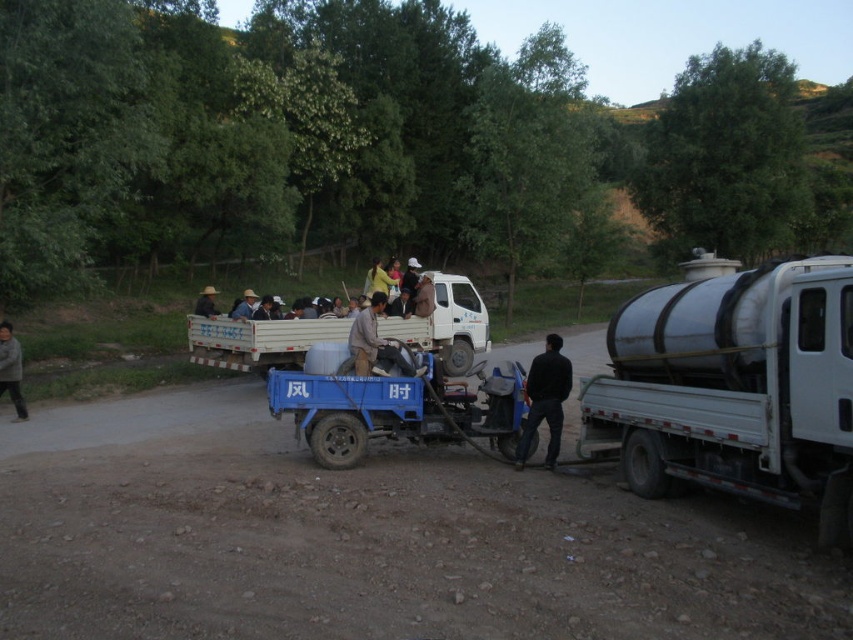
Question: Which point is farther to the camera?

Choices:
 (A) light brown leather jacket at center
 (B) white matte truck at center

Answer: (B)

Question: From the image, what is the correct spatial relationship of white matte truck at center in relation to light brown fabric hat at center?

Choices:
 (A) right
 (B) left

Answer: (A)

Question: Can you confirm if light brown leather jacket at center is thinner than brown fabric hat at upper center?

Choices:
 (A) no
 (B) yes

Answer: (B)

Question: Based on their relative distances, which object is nearer to the blue plastic wagon at center?

Choices:
 (A) brown textured jacket at lower left
 (B) black matte person at center
 (C) light brown fabric hat at center

Answer: (B)

Question: Which object is the farthest from the white matte trailer truck at right?

Choices:
 (A) brown textured jacket at lower left
 (B) white matte truck at center
 (C) black matte person at center
 (D) brown leather jacket at center

Answer: (A)

Question: Is the position of brown fabric hat at upper center less distant than that of light brown fabric hat at center?

Choices:
 (A) no
 (B) yes

Answer: (A)